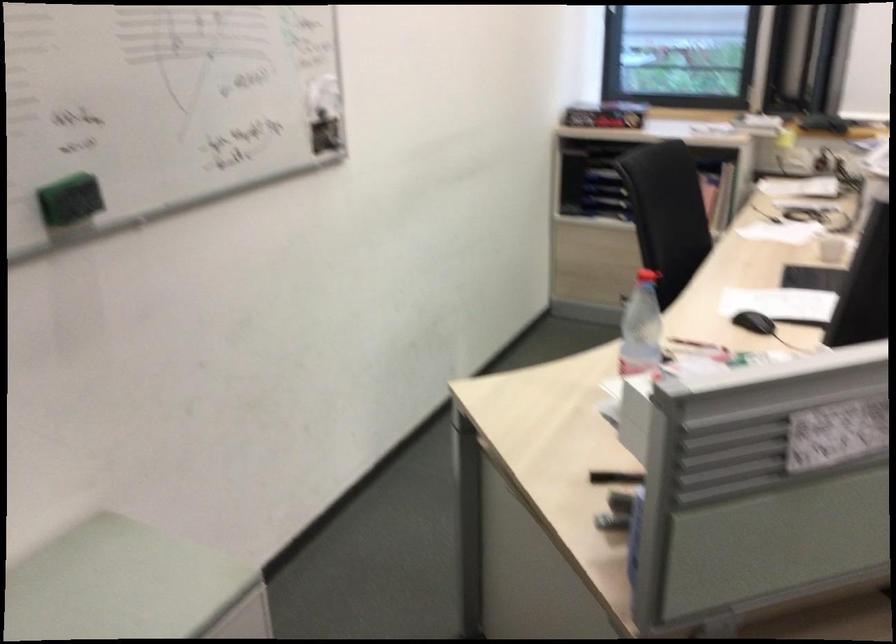
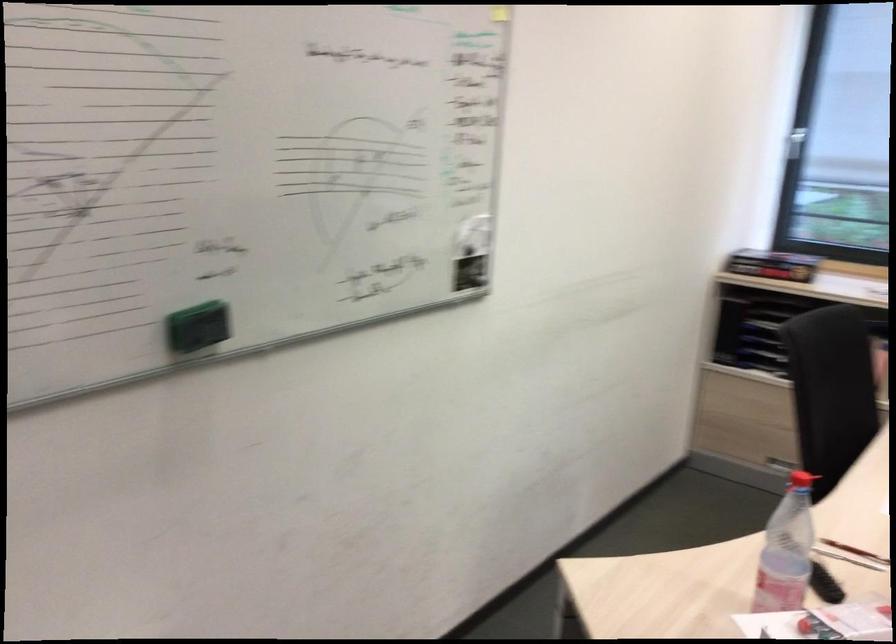
Question: What movement of the cameraman would produce the second image?

Choices:
 (A) Left
 (B) Right
 (C) Forward
 (D) Backward

Answer: (C)